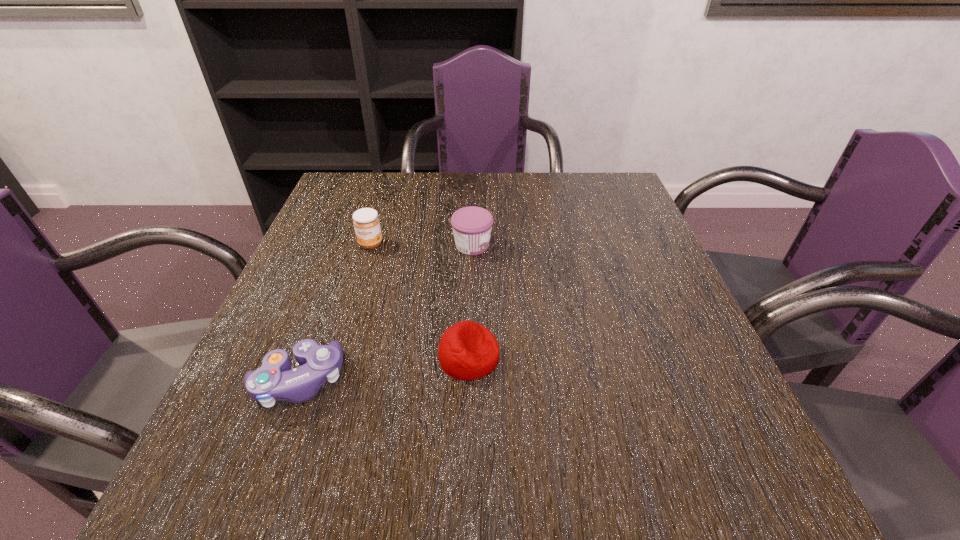
The width and height of the screenshot is (960, 540). I want to click on vacant area that lies between the left jam and the control, so click(x=334, y=312).

Locate an element on the screen. This screenshot has height=540, width=960. free area in between the right jam and the control is located at coordinates point(385,313).

Find the location of a particular element. The image size is (960, 540). free area in between the left jam and the right jam is located at coordinates (421, 245).

Find the location of `vacant area that lies between the beanbag and the right jam`. vacant area that lies between the beanbag and the right jam is located at coordinates (470, 301).

This screenshot has height=540, width=960. Identify the location of free space between the control and the right jam. (x=385, y=313).

This screenshot has width=960, height=540. Identify the location of free space between the control and the right jam. (385, 313).

Locate which object is the closest to the left jam. Please provide its 2D coordinates. Your answer should be formatted as a tuple, i.e. [(x, y)], where the tuple contains the x and y coordinates of a point satisfying the conditions above.

[(472, 226)]

This screenshot has width=960, height=540. I want to click on object that is the third closest to the control, so click(x=472, y=226).

Identify the location of vacant space that satisfies the following two spatial constraints: 1. on the front label of the right jam; 2. on the front side of the control. (469, 381).

The image size is (960, 540). Find the location of `free location that satisfies the following two spatial constraints: 1. on the seat area of the beanbag; 2. on the front side of the control`. free location that satisfies the following two spatial constraints: 1. on the seat area of the beanbag; 2. on the front side of the control is located at coordinates (468, 381).